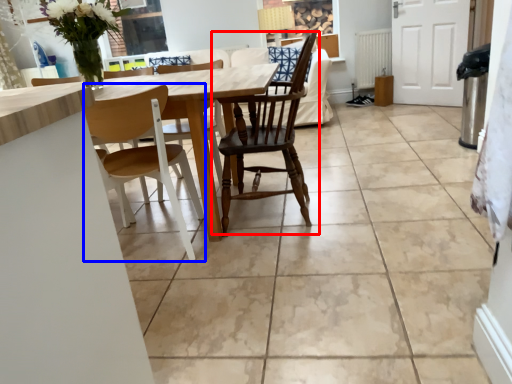
Question: Which object is closer to the camera taking this photo, chair (highlighted by a red box) or chair (highlighted by a blue box)?

Choices:
 (A) chair
 (B) chair

Answer: (B)